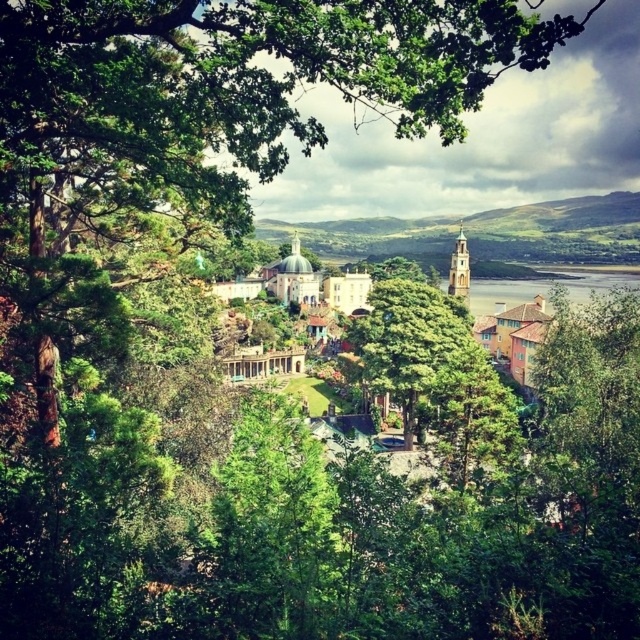
Between point (381, 282) and point (509, 288), which one is positioned behind?

Positioned behind is point (509, 288).

From the picture: Is green leafy tree at center thinner than clear water at lower right?

Yes.

Is point (364, 358) behind point (480, 291)?

That is False.

This screenshot has height=640, width=640. Identify the location of green leafy tree at center. (410, 340).